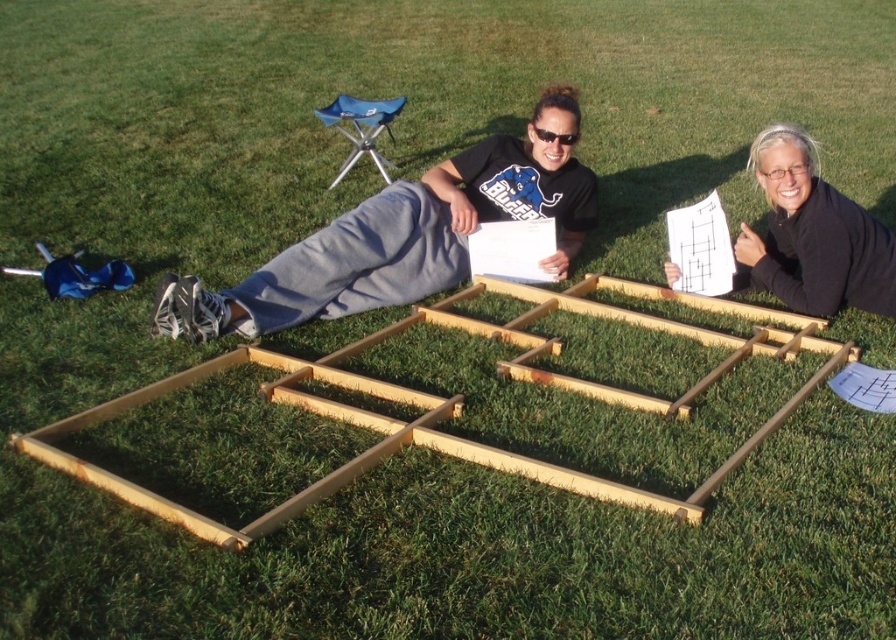
You are standing at the point labeled point (429, 195) and want to walk straight to the point labeled point (785, 269). Will you pass in front of or behind the person on the right?

Since point (429, 195) is behind point 0.423, 0877, walking from point (429, 195) to point (785, 269) would require moving forward towards the latter point. The person on the right is located in front of point (785, 269), so you would pass behind them.

You are a photographer trying to capture a closeup shot of the gray fabric pants at center and the black matte paper at upper right. Which object should you focus on first to ensure it appears sharp in the photo?

You should focus on the gray fabric pants at center first because it is closer to the viewer than the black matte paper at upper right, so focusing on it will keep it sharp while the paper may appear slightly out of focus.